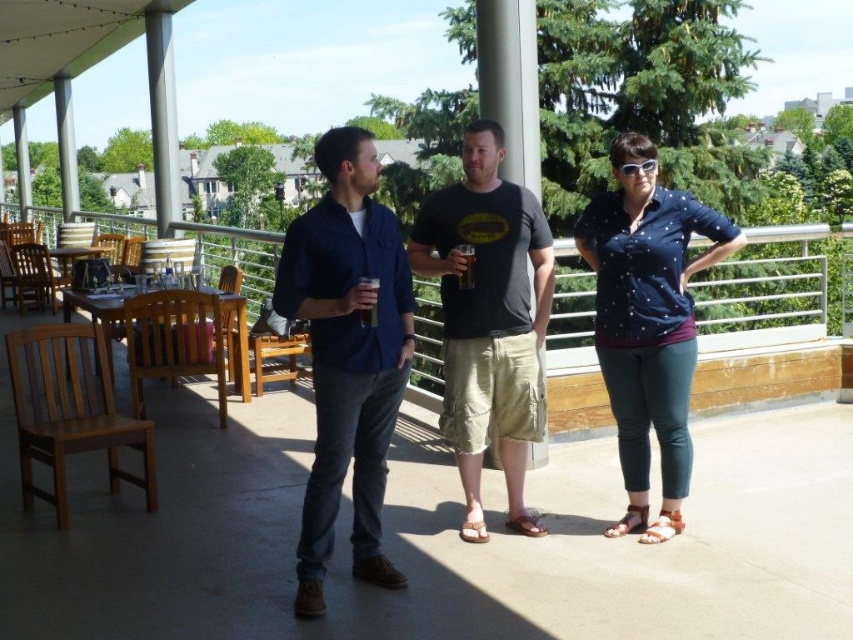
Question: Is navy blue shirt at center smaller than translucent glass at center?

Choices:
 (A) no
 (B) yes

Answer: (A)

Question: Can you confirm if dark gray t-shirt at center is positioned to the left of translucent glass at center?

Choices:
 (A) no
 (B) yes

Answer: (A)

Question: Can you confirm if dark gray t-shirt at center is wider than navy blue shirt at center?

Choices:
 (A) no
 (B) yes

Answer: (A)

Question: Which of the following is the closest to the observer?

Choices:
 (A) (374, 497)
 (B) (466, 243)
 (C) (434, 195)
 (D) (637, 339)

Answer: (A)

Question: Which object is the closest to the matte blue shirt at center?

Choices:
 (A) translucent glass at center
 (B) navy blue shirt at center
 (C) dark gray t-shirt at center

Answer: (C)

Question: Which object is positioned closest to the matte blue shirt at center?

Choices:
 (A) dark gray t-shirt at center
 (B) translucent glass at center
 (C) navy blue shirt at center

Answer: (A)